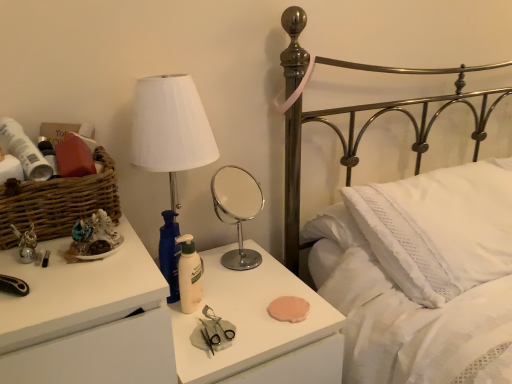
Question: Considering their positions, is matte plastic lotion at center, which is the second nightstand in left-to-right order, located in front of or behind brown woven basket at left?

Choices:
 (A) behind
 (B) front

Answer: (A)

Question: Is matte plastic lotion at center, which is the second nightstand in left-to-right order, inside the boundaries of brown woven basket at left, or outside?

Choices:
 (A) inside
 (B) outside

Answer: (B)

Question: Which object is positioned closest to the white matte nightstand at left, placed as the first nightstand when sorted from left to right?

Choices:
 (A) metallic brass bed at upper right
 (B) white matte lotion at center
 (C) white fabric lampshade at upper left
 (D) chrome/metallic round mirror at center
 (E) white textured pillow at center

Answer: (B)

Question: Based on their relative distances, which object is farther from the white textured pillow at center?

Choices:
 (A) white matte nightstand at left, the 2th nightstand in the right-to-left sequence
 (B) white matte lotion at center
 (C) matte plastic lotion at center, which appears as the first nightstand when viewed from the right
 (D) metallic brass bed at upper right
 (E) brown woven basket at left

Answer: (E)